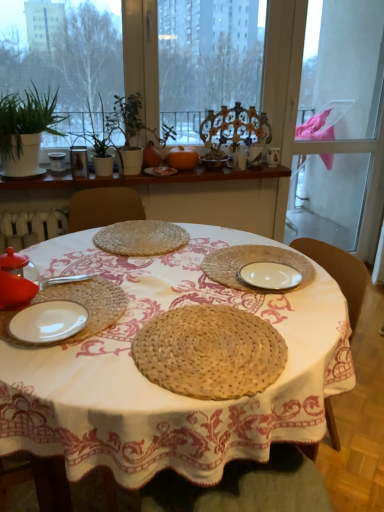
Identify the location of empty space that is ontop of white matte plate at center, arranged as the 1th plate when viewed from the top (from a real-world perspective). (161, 167).